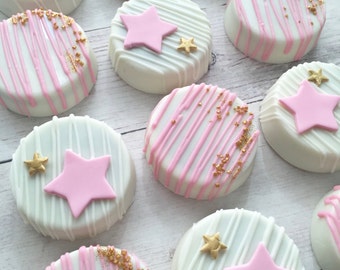
This screenshot has height=270, width=340. Identify the location of wooden table. (154, 229), (27, 243), (269, 205), (110, 97), (231, 75), (334, 20), (91, 12), (6, 132).